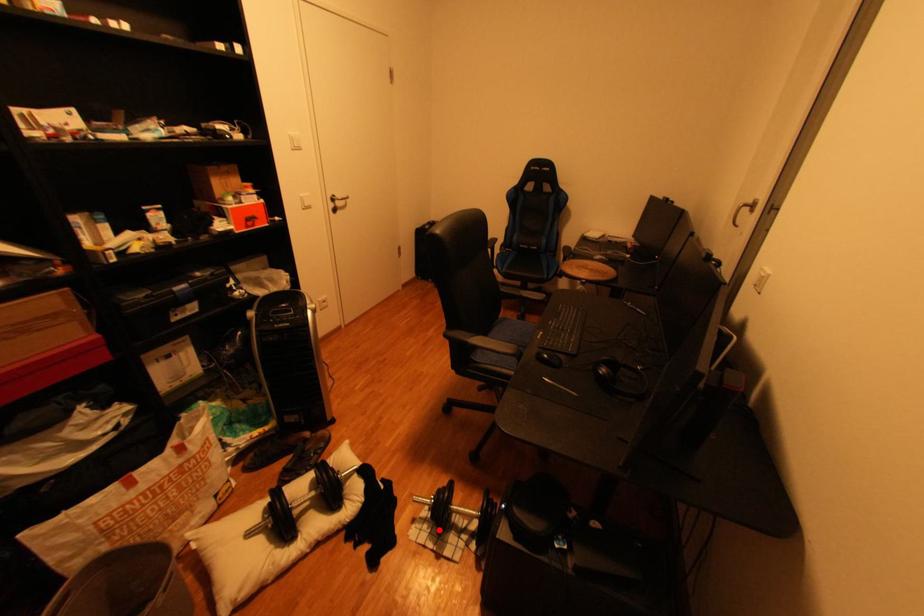
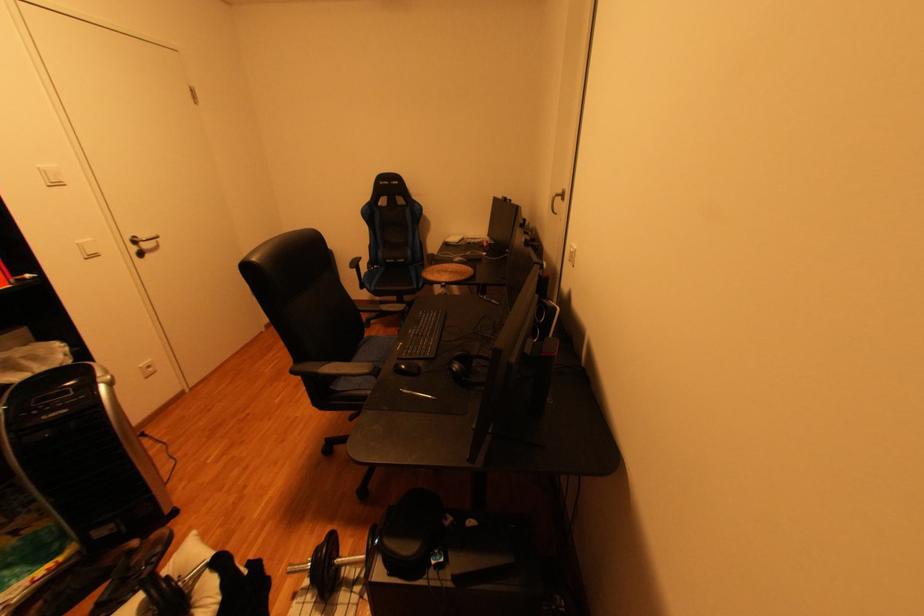
Locate, in the second image, the point that corresponds to the highlighted location in the first image.

(323, 600)